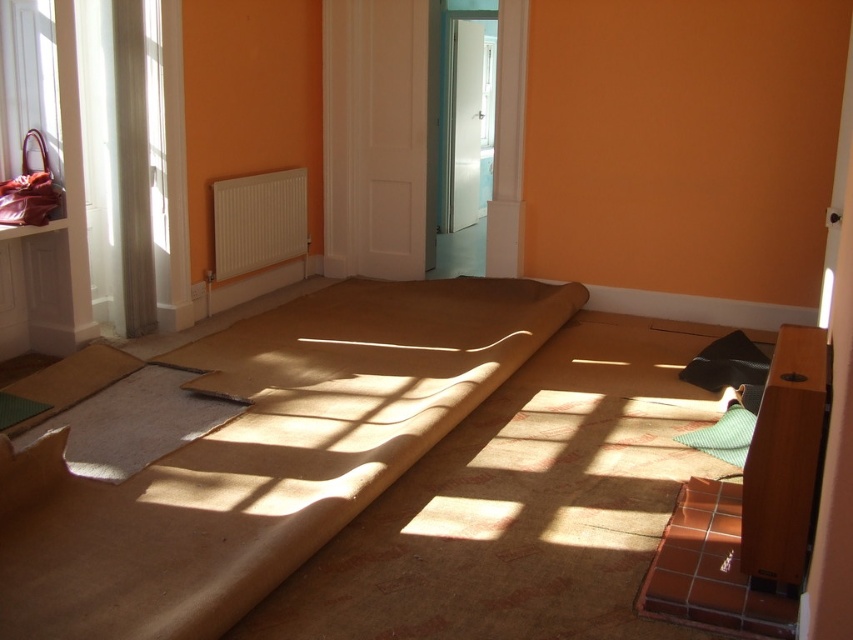
How far apart are white sheer curtain at left and black matte pillow at lower right?

white sheer curtain at left and black matte pillow at lower right are 11.46 feet apart from each other.

Locate an element on the screen. white sheer curtain at left is located at coordinates pyautogui.click(x=155, y=122).

Does white plastic radiator at center have a smaller size compared to white sheer curtain at left?

Actually, white plastic radiator at center might be larger than white sheer curtain at left.

Is white plastic radiator at center closer to the viewer compared to white sheer curtain at left?

No, it is behind white sheer curtain at left.

Does point (224, 278) come closer to viewer compared to point (160, 109)?

No, (224, 278) is behind (160, 109).

Where is `white plastic radiator at center`? The image size is (853, 640). white plastic radiator at center is located at coordinates (258, 221).

Can you confirm if light gray felt mat at center is wider than white sheer curtain at left?

Yes, light gray felt mat at center is wider than white sheer curtain at left.

Is point (131, 426) positioned after point (155, 160)?

No.

What do you see at coordinates (132, 422) in the screenshot? Image resolution: width=853 pixels, height=640 pixels. I see `light gray felt mat at center` at bounding box center [132, 422].

At what (x,y) coordinates should I click in order to perform the action: click on light gray felt mat at center. Please return your answer as a coordinate pair (x, y). Looking at the image, I should click on (132, 422).